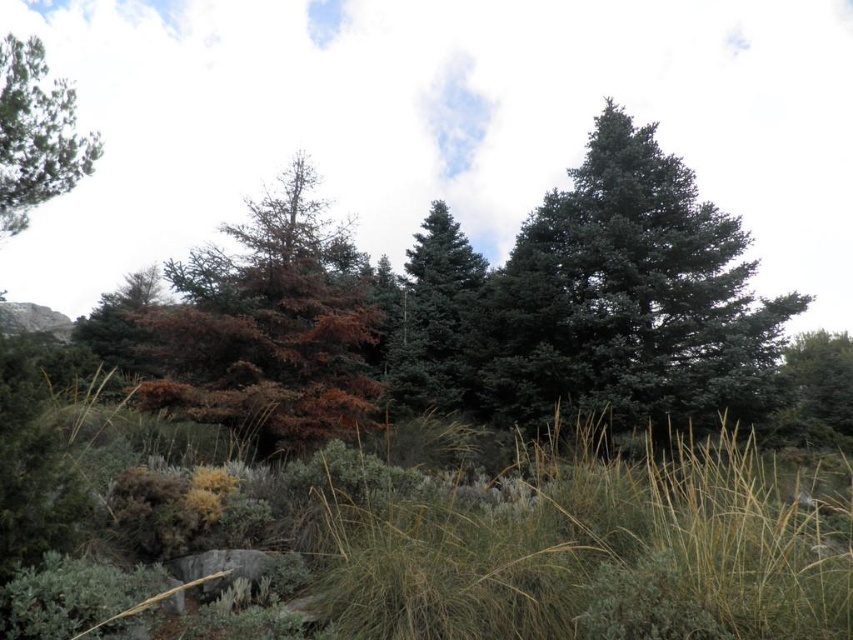
From the picture: Which is above, dark green fir tree at center or green matte tree at center?

dark green fir tree at center is above.

Who is lower down, dark green fir tree at center or green matte tree at center?

Positioned lower is green matte tree at center.

Locate an element on the screen. The image size is (853, 640). dark green fir tree at center is located at coordinates (630, 300).

In the scene shown: Is green matte tree at center positioned in front of brown matte tree at left?

No, green matte tree at center is behind brown matte tree at left.

Can you confirm if green matte tree at center is shorter than brown matte tree at left?

In fact, green matte tree at center may be taller than brown matte tree at left.

Find the location of a particular element. Image resolution: width=853 pixels, height=640 pixels. green matte tree at center is located at coordinates (434, 316).

Does green fuzzy grass at center have a lesser height compared to green matte tree at upper left?

Correct, green fuzzy grass at center is not as tall as green matte tree at upper left.

Does green fuzzy grass at center have a greater height compared to green matte tree at upper left?

No, green fuzzy grass at center is not taller than green matte tree at upper left.

You are a GUI agent. You are given a task and a screenshot of the screen. Output one action in this format:
    pyautogui.click(x=<x>, y=<y>)
    Task: Click on the green fuzzy grass at center
    
    Given the screenshot: What is the action you would take?
    pyautogui.click(x=581, y=544)